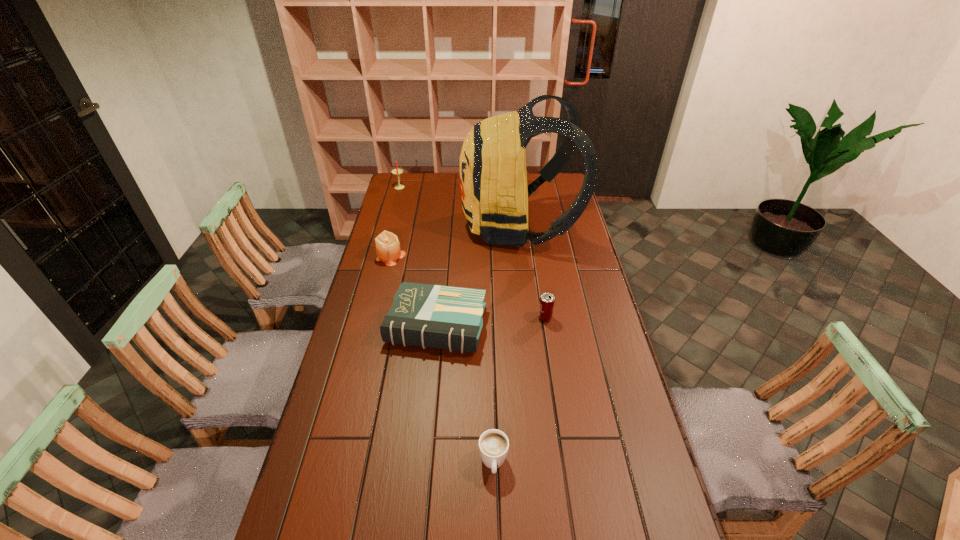
I want to click on free space that satisfies the following two spatial constraints: 1. on the front-facing side of the beer can; 2. on the right side of the backpack, so click(x=529, y=318).

You are a GUI agent. You are given a task and a screenshot of the screen. Output one action in this format:
    pyautogui.click(x=<x>, y=<y>)
    Task: Click on the vacant area in the image that satisfies the following two spatial constraints: 1. on the front side of the paperback book; 2. on the left side of the farthest object
    The width and height of the screenshot is (960, 540).
    Given the screenshot: What is the action you would take?
    pyautogui.click(x=362, y=326)

Locate an element on the screen. This screenshot has height=540, width=960. free location that satisfies the following two spatial constraints: 1. on the front-facing side of the tallest object; 2. on the front side of the paperback book is located at coordinates (530, 326).